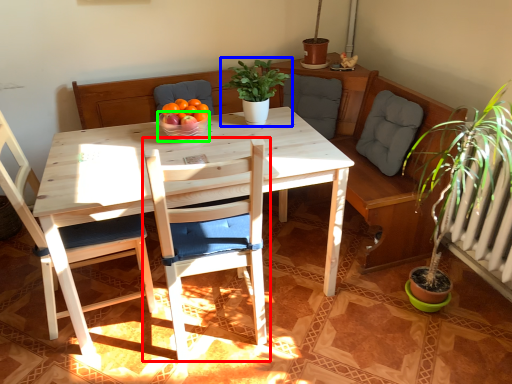
Question: Estimate the real-world distances between objects in this image. Which object is closer to chair (highlighted by a red box), houseplant (highlighted by a blue box) or glass bowl (highlighted by a green box)?

Choices:
 (A) houseplant
 (B) glass bowl

Answer: (B)